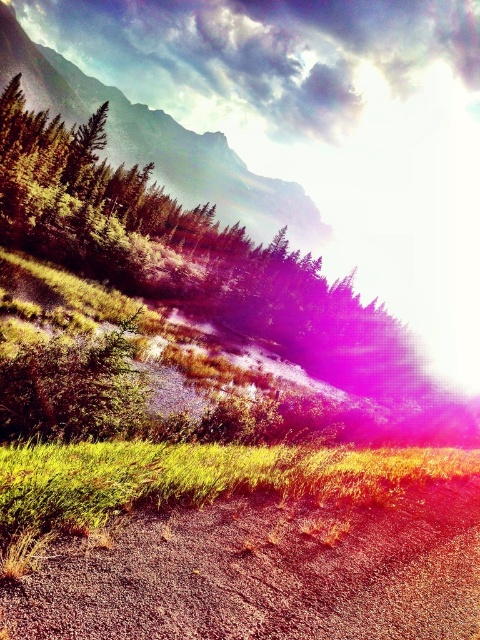
Question: Can you confirm if brown gravel dirt track at lower center is thinner than green textured mountain at upper left?

Choices:
 (A) yes
 (B) no

Answer: (A)

Question: Can you confirm if brown gravel dirt track at lower center is positioned below green textured mountain at upper left?

Choices:
 (A) yes
 (B) no

Answer: (A)

Question: Does brown gravel dirt track at lower center lie behind green textured mountain at upper left?

Choices:
 (A) no
 (B) yes

Answer: (A)

Question: Which point appears closest to the camera in this image?

Choices:
 (A) (275, 518)
 (B) (141, 145)

Answer: (A)

Question: Which object appears closest to the camera in this image?

Choices:
 (A) brown gravel dirt track at lower center
 (B) green textured mountain at upper left

Answer: (A)